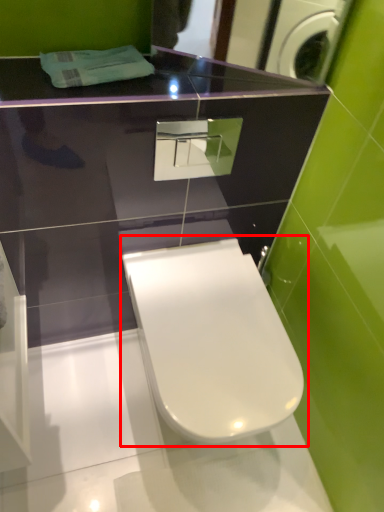
Question: From the image's perspective, what is the correct spatial relationship of toilet (annotated by the red box) in relation to mirror?

Choices:
 (A) above
 (B) below

Answer: (B)